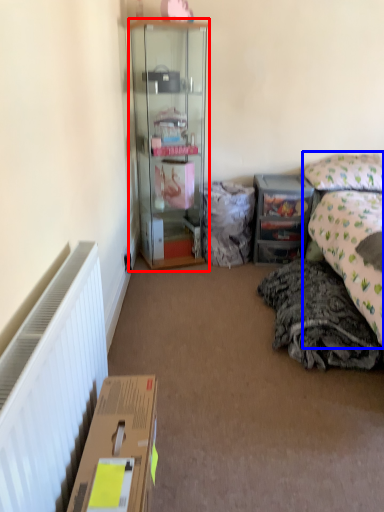
Question: Among these objects, which one is farthest to the camera, cabinetry (highlighted by a red box) or bed (highlighted by a blue box)?

Choices:
 (A) cabinetry
 (B) bed

Answer: (A)